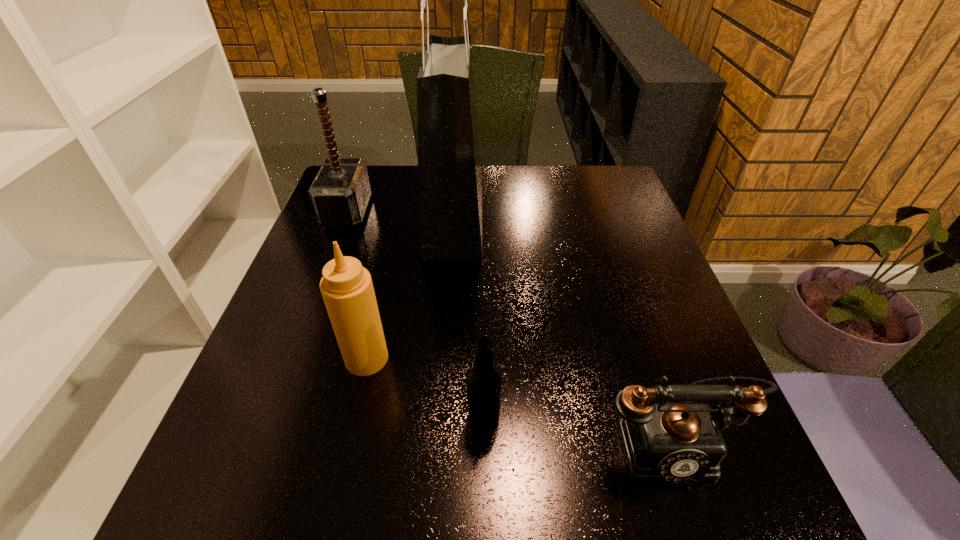
Identify the location of blank region between the hammer and the shopping bag. (400, 215).

The height and width of the screenshot is (540, 960). Find the location of `object that is the fourth closest to the rightmost object`. object that is the fourth closest to the rightmost object is located at coordinates (340, 192).

Locate an element on the screen. This screenshot has height=540, width=960. the fourth closest object to the third nearest object is located at coordinates (674, 442).

Identify the location of vacant point that satisfies the following two spatial constraints: 1. on the front with handles of the tallest object; 2. on the left side of the beer bottle. (440, 418).

The height and width of the screenshot is (540, 960). What are the coordinates of `vacant space that satisfies the following two spatial constraints: 1. on the front with handles of the tallest object; 2. on the front side of the third tallest object` in the screenshot? It's located at (444, 359).